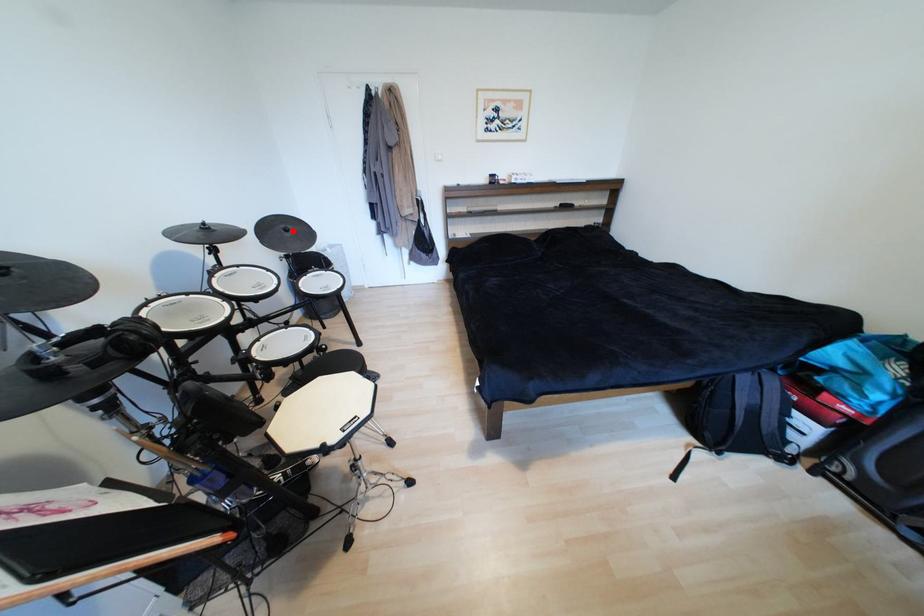
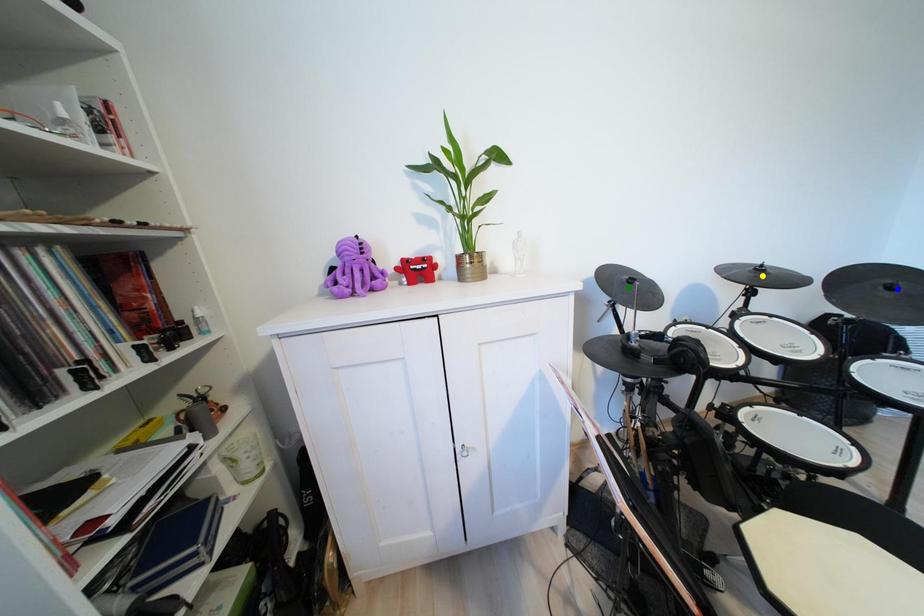
Question: I am providing you with two images of the same scene from different viewpoints. A red point is marked on the first image. You are given multiple points on the second image. Which spot in image 2 lines up with the point in image 1?

Choices:
 (A) yellow point
 (B) green point
 (C) blue point

Answer: (C)